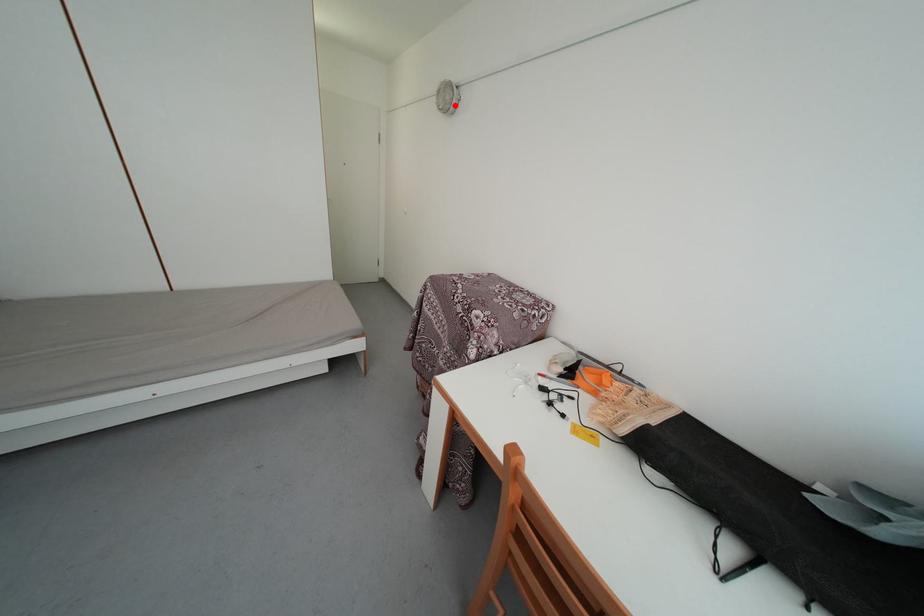
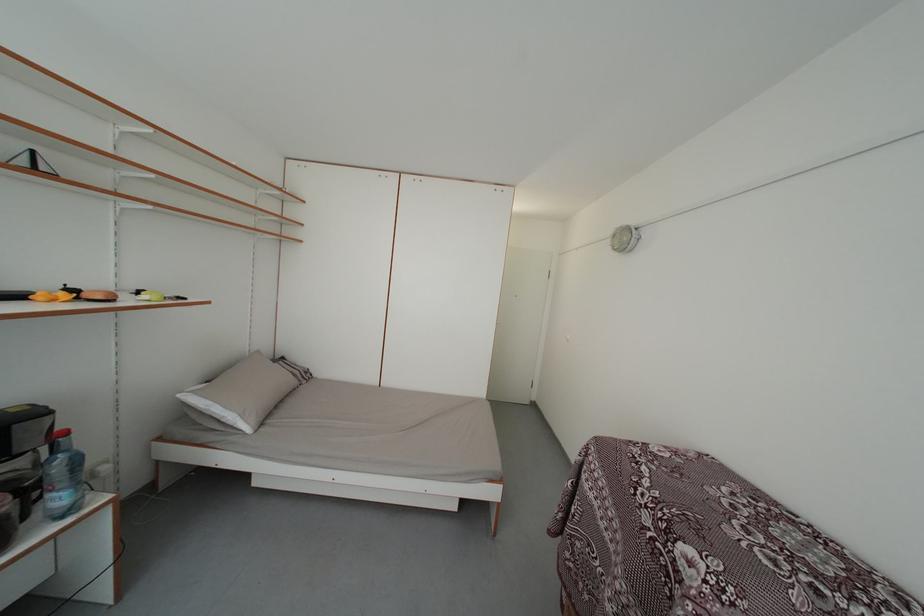
Find the pixel in the second image that matches the highlighted location in the first image.

(631, 246)